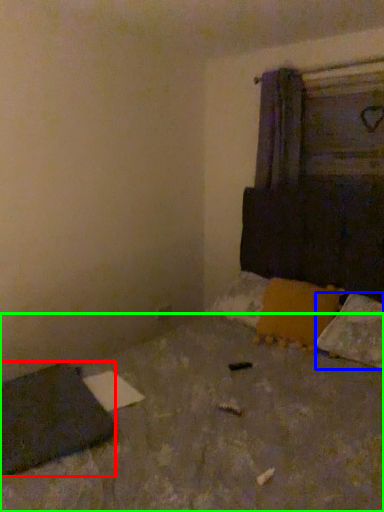
Question: Estimate the real-world distances between objects in this image. Which object is farther from pad (highlighted by a red box), pillow (highlighted by a blue box) or concrete (highlighted by a green box)?

Choices:
 (A) pillow
 (B) concrete

Answer: (A)